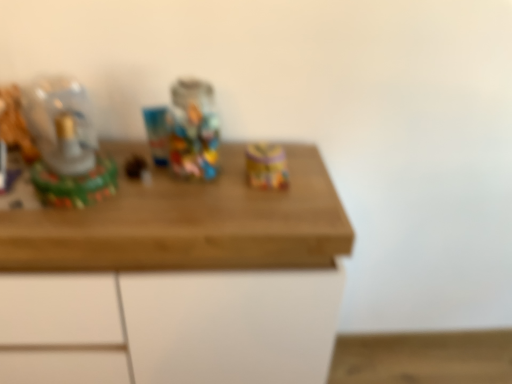
What do you see at coordinates (189, 224) in the screenshot? I see `wooden at center` at bounding box center [189, 224].

Where is `wooden at center`? wooden at center is located at coordinates (189, 224).

In order to face wooden at center, should I rotate leftwards or rightwards?

Rotate your view left by about 16.033°.

Where is `wooden at center`? wooden at center is located at coordinates (189, 224).